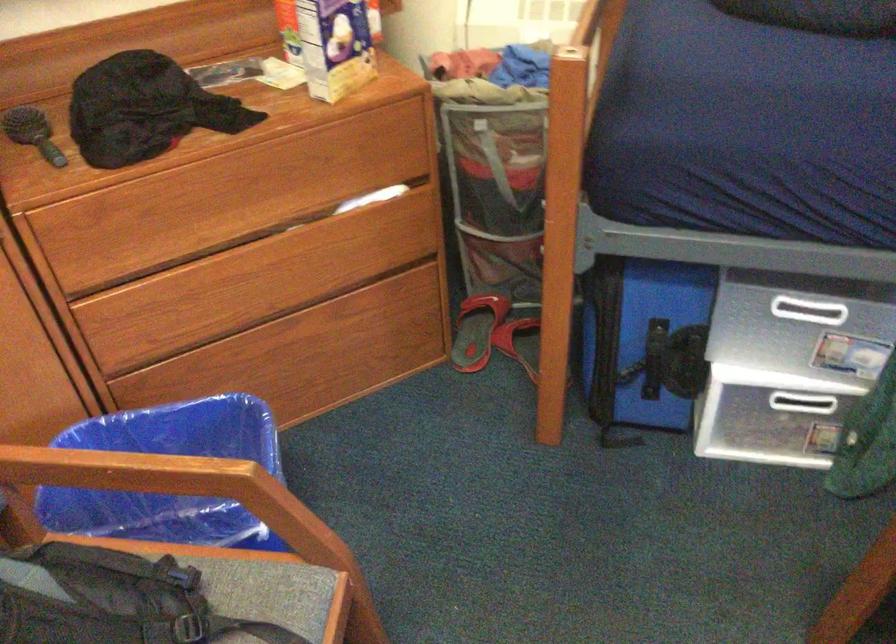
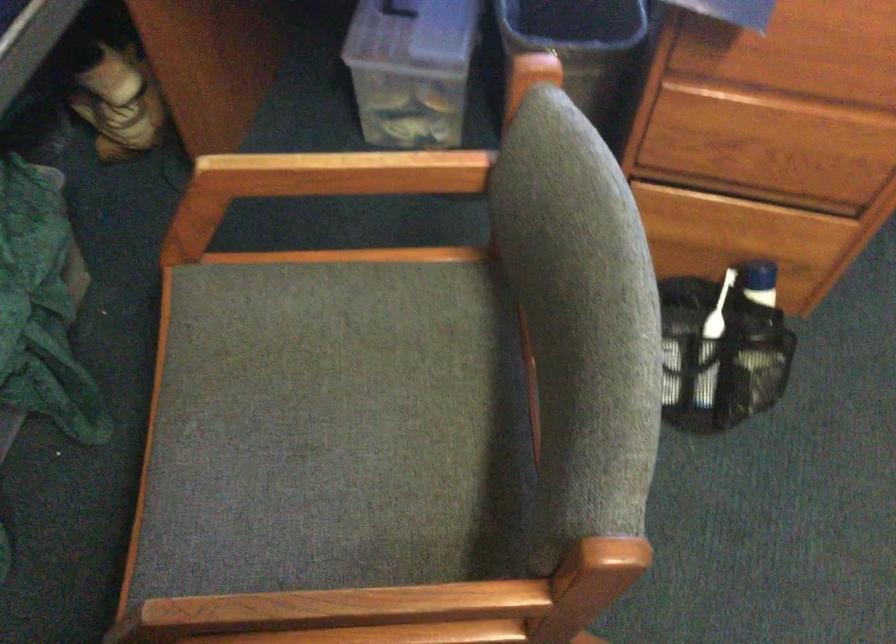
The first image is from the beginning of the video and the second image is from the end. How did the camera likely rotate when shooting the video?

The rotation direction of the camera is right-down.